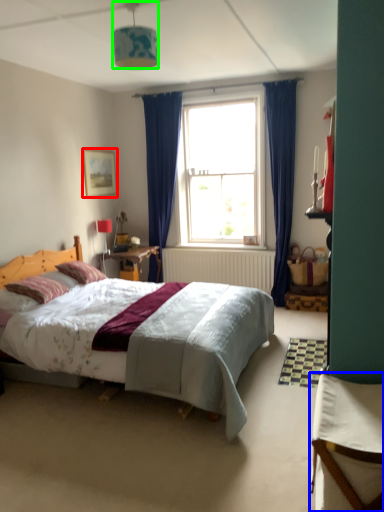
Question: Considering the real-world distances, which object is farthest from picture frame (highlighted by a red box)? table (highlighted by a blue box) or lamp (highlighted by a green box)?

Choices:
 (A) table
 (B) lamp

Answer: (A)